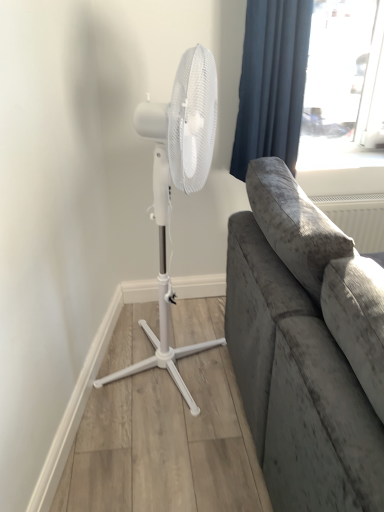
You are a GUI agent. You are given a task and a screenshot of the screen. Output one action in this format:
    pyautogui.click(x=<x>, y=<y>)
    Task: Click on the vacant area that is in front of white plastic mechanical fan at left
    
    Given the screenshot: What is the action you would take?
    pyautogui.click(x=158, y=447)